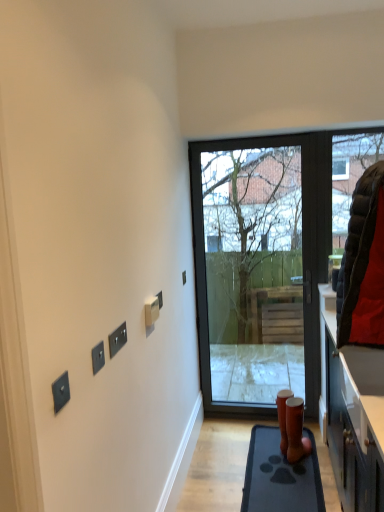
Where is `vacant space to the left of brown matte vase at lower center`? vacant space to the left of brown matte vase at lower center is located at coordinates [x=271, y=451].